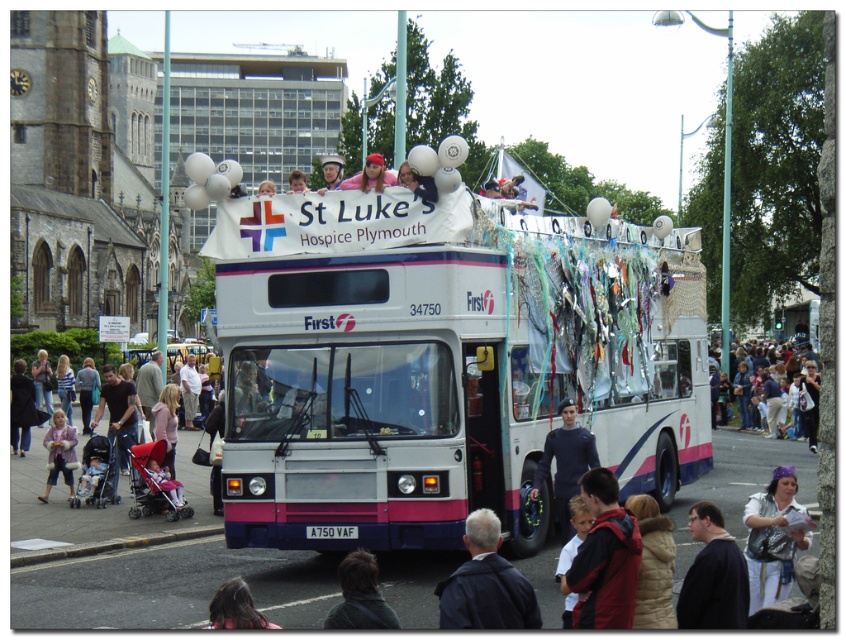
Does point (806, 433) lie behind point (377, 588)?

That is True.

Is light beige fabric crowd at right bigger than dark brown hair at lower center?

Yes.

Is point (739, 365) positioned before point (363, 605)?

No, (739, 365) is further to viewer.

What are the coordinates of `light beige fabric crowd at right` in the screenshot? It's located at (792, 401).

Who is positioned more to the right, white glossy/decorative decker bus at center or dark blue fabric at center?

dark blue fabric at center

Who is more forward, (481,432) or (558,515)?

Point (481,432)

The width and height of the screenshot is (846, 640). In order to click on white glossy/decorative decker bus at center in this screenshot , I will do `click(443, 365)`.

Can you confirm if dark red jacket at lower center is positioned above dark blue fabric at center?

Actually, dark red jacket at lower center is below dark blue fabric at center.

Between point (597, 502) and point (564, 502), which one is positioned behind?

Point (564, 502)

Is point (608, 531) in front of point (596, 464)?

That is True.

The height and width of the screenshot is (640, 846). What are the coordinates of `dark red jacket at lower center` in the screenshot? It's located at (603, 557).